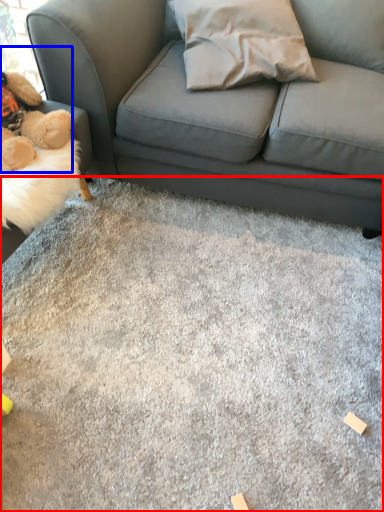
Question: Which object appears closest to the camera in this image, concrete (highlighted by a red box) or toy (highlighted by a blue box)?

Choices:
 (A) concrete
 (B) toy

Answer: (A)